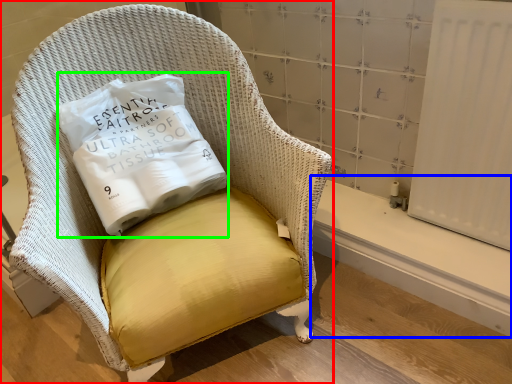
Question: Estimate the real-world distances between objects in this image. Which object is closer to chair (highlighted by a red box), window sill (highlighted by a blue box) or pillow (highlighted by a green box)?

Choices:
 (A) window sill
 (B) pillow

Answer: (B)